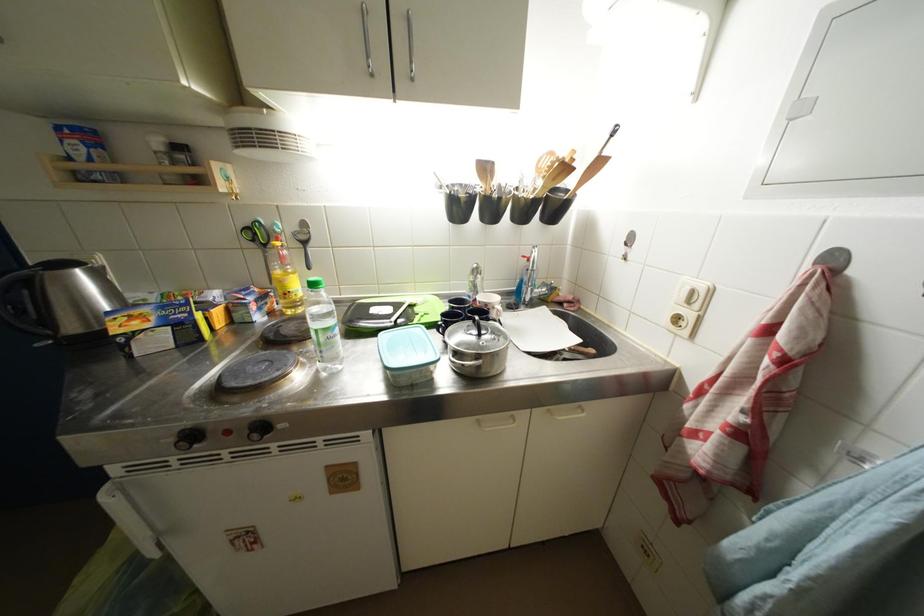
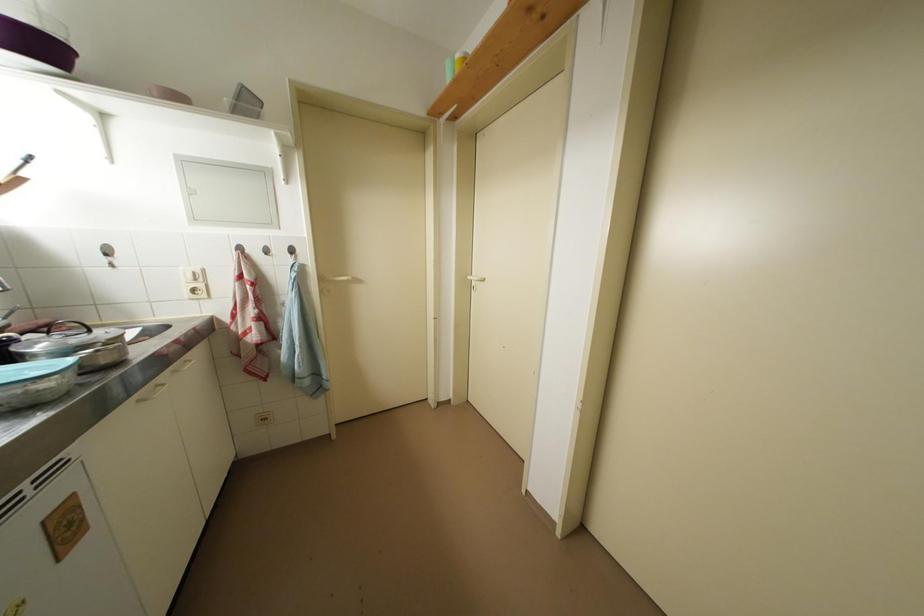
The images are taken continuously from a first-person perspective. In which direction is your viewpoint rotating?

The camera rotated toward right-down.